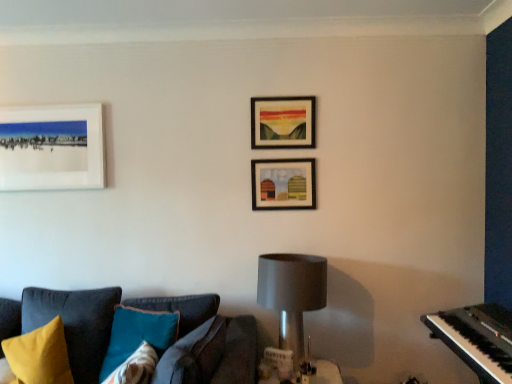
Question: Considering the relative positions of wooden frame at upper center, arranged as the second picture frame when viewed from the right, and black plastic piano at right in the image provided, is wooden frame at upper center, arranged as the second picture frame when viewed from the right, to the left of black plastic piano at right from the viewer's perspective?

Choices:
 (A) no
 (B) yes

Answer: (B)

Question: Is wooden frame at upper center, positioned as the second picture frame in left-to-right order, taller than black plastic piano at right?

Choices:
 (A) no
 (B) yes

Answer: (B)

Question: Is wooden frame at upper center, positioned as the second picture frame in left-to-right order, thinner than black plastic piano at right?

Choices:
 (A) yes
 (B) no

Answer: (A)

Question: Is wooden frame at upper center, positioned as the second picture frame in left-to-right order, outside black plastic piano at right?

Choices:
 (A) yes
 (B) no

Answer: (A)

Question: Is wooden frame at upper center, arranged as the second picture frame when viewed from the right, oriented towards black plastic piano at right?

Choices:
 (A) yes
 (B) no

Answer: (B)

Question: From a real-world perspective, is wooden frame at upper center, positioned as the second picture frame in left-to-right order, on black plastic piano at right?

Choices:
 (A) yes
 (B) no

Answer: (A)

Question: Are wooden frame at center, arranged as the first picture frame when viewed from the right, and white matte picture frame at upper left, the 3th picture frame viewed from the right, making contact?

Choices:
 (A) no
 (B) yes

Answer: (A)

Question: Considering the relative positions of wooden frame at center, arranged as the first picture frame when viewed from the right, and white matte picture frame at upper left, the 1th picture frame in the left-to-right sequence, in the image provided, is wooden frame at center, arranged as the first picture frame when viewed from the right, behind white matte picture frame at upper left, the 1th picture frame in the left-to-right sequence,?

Choices:
 (A) yes
 (B) no

Answer: (A)

Question: Is white matte picture frame at upper left, the 1th picture frame in the left-to-right sequence, at the back of wooden frame at center, arranged as the first picture frame when viewed from the right?

Choices:
 (A) yes
 (B) no

Answer: (B)

Question: From a real-world perspective, is wooden frame at center, arranged as the first picture frame when viewed from the right, located higher than white matte picture frame at upper left, the 3th picture frame viewed from the right?

Choices:
 (A) no
 (B) yes

Answer: (A)

Question: Is wooden frame at center, arranged as the first picture frame when viewed from the right, shorter than white matte picture frame at upper left, the 1th picture frame in the left-to-right sequence?

Choices:
 (A) yes
 (B) no

Answer: (A)

Question: Can you confirm if wooden frame at center, placed as the 3th picture frame when sorted from left to right, is taller than white matte picture frame at upper left, the 3th picture frame viewed from the right?

Choices:
 (A) yes
 (B) no

Answer: (B)

Question: Is black plastic piano at right oriented away from wooden frame at upper center, arranged as the second picture frame when viewed from the right?

Choices:
 (A) yes
 (B) no

Answer: (B)